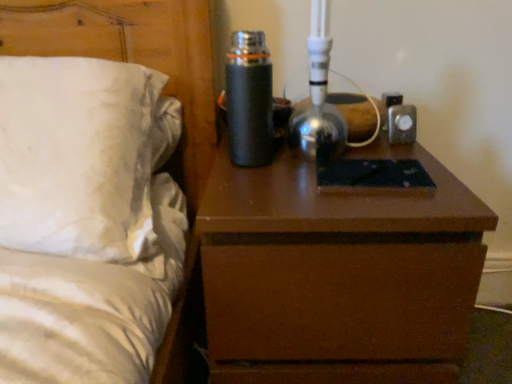
Measure the distance between brown matte nightstand at center and camera.

The distance of brown matte nightstand at center from camera is 21.85 inches.

Image resolution: width=512 pixels, height=384 pixels. Describe the element at coordinates (338, 274) in the screenshot. I see `brown matte nightstand at center` at that location.

Identify the location of black matte thermos at upper center. The height and width of the screenshot is (384, 512). (249, 100).

Considering the sizes of objects white satin bed at left and brown matte nightstand at center in the image provided, who is bigger, white satin bed at left or brown matte nightstand at center?

white satin bed at left is bigger.

In the scene shown: Which of these two, white satin bed at left or brown matte nightstand at center, stands shorter?

With less height is brown matte nightstand at center.

In terms of width, does white satin bed at left look wider or thinner when compared to brown matte nightstand at center?

In the image, white satin bed at left appears to be more narrow than brown matte nightstand at center.

Are black matte thermos at upper center and white satin bed at left beside each other?

No, black matte thermos at upper center is not making contact with white satin bed at left.

Is black matte thermos at upper center thinner than white satin bed at left?

Correct, the width of black matte thermos at upper center is less than that of white satin bed at left.

Considering the sizes of objects black matte thermos at upper center and white satin bed at left in the image provided, who is shorter, black matte thermos at upper center or white satin bed at left?

Standing shorter between the two is black matte thermos at upper center.

How distant is black matte thermos at upper center from white satin bed at left?

The distance of black matte thermos at upper center from white satin bed at left is 9.95 inches.

I want to click on nightstand that is on the right side of white satin bed at left, so click(338, 274).

Considering the positions of objects brown matte nightstand at center and white satin bed at left in the image provided, who is more to the left, brown matte nightstand at center or white satin bed at left?

white satin bed at left is more to the left.

Are brown matte nightstand at center and white satin bed at left far apart?

No, there isn't a large distance between brown matte nightstand at center and white satin bed at left.

Is brown matte nightstand at center far from black matte thermos at upper center?

Actually, brown matte nightstand at center and black matte thermos at upper center are a little close together.

How many degrees apart are the facing directions of brown matte nightstand at center and black matte thermos at upper center?

The facing directions of brown matte nightstand at center and black matte thermos at upper center are 1.4 degrees apart.

Is brown matte nightstand at center positioned beyond the bounds of black matte thermos at upper center?

Yes.

Which of these two, white satin bed at left or black matte thermos at upper center, stands shorter?

Standing shorter between the two is black matte thermos at upper center.

Would you say white satin bed at left is outside black matte thermos at upper center?

Yes, white satin bed at left is located beyond the bounds of black matte thermos at upper center.

Is white satin bed at left in contact with black matte thermos at upper center?

No, white satin bed at left is not next to black matte thermos at upper center.

Measure the distance from white satin bed at left to black matte thermos at upper center.

9.95 inches.

Is black matte thermos at upper center surrounding brown matte nightstand at center?

Actually, brown matte nightstand at center is outside black matte thermos at upper center.

Based on the photo, is black matte thermos at upper center positioned far away from brown matte nightstand at center?

No, black matte thermos at upper center is not far from brown matte nightstand at center.

Is black matte thermos at upper center bigger or smaller than brown matte nightstand at center?

Considering their sizes, black matte thermos at upper center takes up less space than brown matte nightstand at center.

Locate an element on the screen. bottle that is above the brown matte nightstand at center (from the image's perspective) is located at coordinates (249, 100).

Where is `bed located above the brown matte nightstand at center (from the image's perspective)`? Image resolution: width=512 pixels, height=384 pixels. bed located above the brown matte nightstand at center (from the image's perspective) is located at coordinates (134, 58).

Locate an element on the screen. This screenshot has width=512, height=384. bed below the black matte thermos at upper center (from the image's perspective) is located at coordinates (134, 58).

Looking at the image, which one is located further to white satin bed at left, black matte thermos at upper center or brown matte nightstand at center?

brown matte nightstand at center lies further to white satin bed at left than the other object.

Based on their spatial positions, is black matte thermos at upper center or white satin bed at left closer to brown matte nightstand at center?

black matte thermos at upper center is closer to brown matte nightstand at center.

Estimate the real-world distances between objects in this image. Which object is further from white satin bed at left, brown matte nightstand at center or black matte thermos at upper center?

Among the two, brown matte nightstand at center is located further to white satin bed at left.

Estimate the real-world distances between objects in this image. Which object is closer to brown matte nightstand at center, white satin bed at left or black matte thermos at upper center?

black matte thermos at upper center is positioned closer to the anchor brown matte nightstand at center.

Looking at the image, which one is located further to black matte thermos at upper center, brown matte nightstand at center or white satin bed at left?

The object further to black matte thermos at upper center is white satin bed at left.

From the image, which object appears to be farther from black matte thermos at upper center, white satin bed at left or brown matte nightstand at center?

Among the two, white satin bed at left is located further to black matte thermos at upper center.

Locate an element on the screen. bottle between white satin bed at left and brown matte nightstand at center is located at coordinates (249, 100).